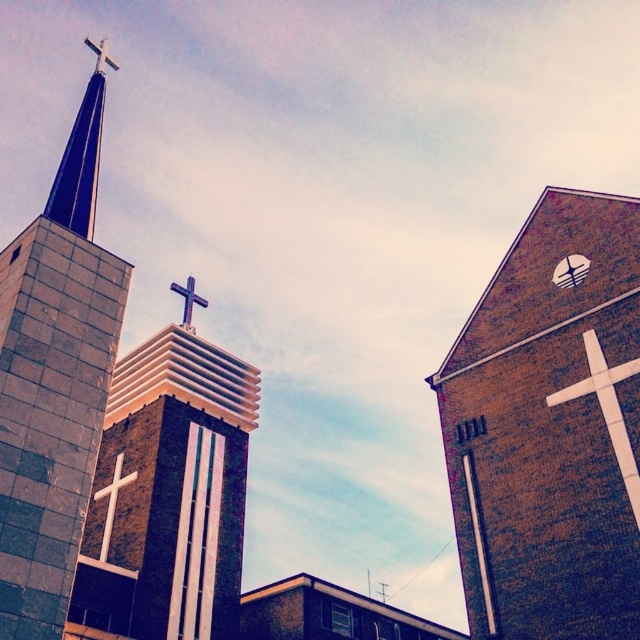
From the picture: Between smooth concrete steeple at left and white matte cross at upper right, which one is positioned higher?

smooth concrete steeple at left

How far apart are smooth concrete steeple at left and white matte cross at upper right?

smooth concrete steeple at left is 79.31 feet from white matte cross at upper right.

Between point (96, 289) and point (605, 410), which one is positioned in front?

Positioned in front is point (605, 410).

Locate an element on the screen. The height and width of the screenshot is (640, 640). smooth concrete steeple at left is located at coordinates (54, 381).

Who is lower down, white brick cross at upper center or white matte cross at upper right?

white matte cross at upper right is lower down.

Does white brick cross at upper center appear on the left side of white matte cross at upper right?

Indeed, white brick cross at upper center is positioned on the left side of white matte cross at upper right.

Does point (515, 476) come farther from viewer compared to point (628, 476)?

That is True.

The image size is (640, 640). In order to click on white brick cross at upper center in this screenshot , I will do `click(548, 429)`.

In the scene shown: Can you confirm if metallic cross at center is thinner than white matte cross at upper left?

Yes.

Does point (180, 294) lie in front of point (106, 49)?

No.

This screenshot has height=640, width=640. I want to click on metallic cross at center, so click(x=188, y=300).